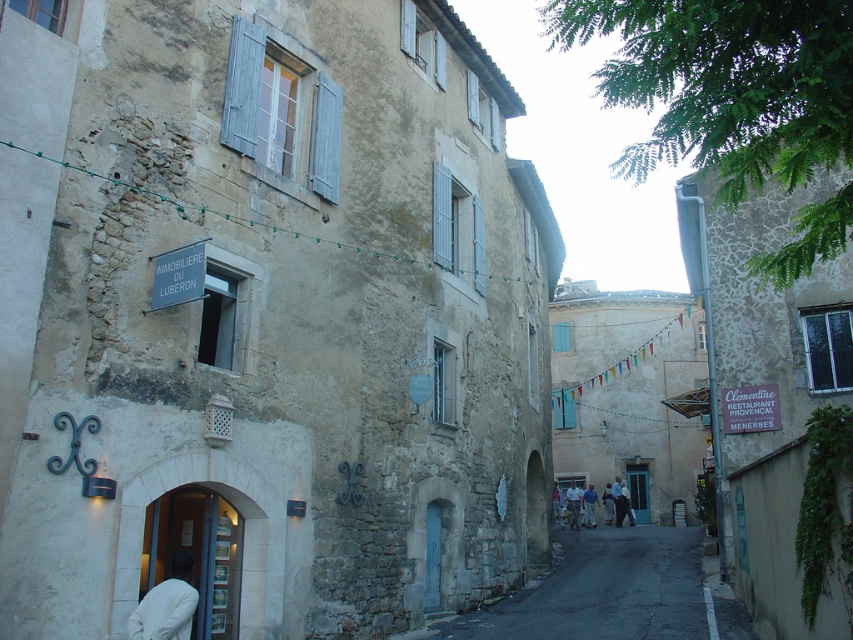
You are a delivery person driving a truck that is 2 meters wide. You need to pass through the street shown in the image. Can your truck fit through the space between the dark asphalt road at center and the white cloth at lower left?

The dark asphalt road at center might be wider than white cloth at lower left, so there is a possibility that the truck can pass through, but there is uncertainty due to the comparative width not being definitively confirmed.

You are a tourist in the village and want to take a photo of the stone signboard at upper center without the dark asphalt road at center blocking it. How should you position yourself relative to the road?

The stone signboard at upper center is behind the dark asphalt road at center. To avoid the road blocking the signboard, you should position yourself behind the dark asphalt road at center so that the road is between you and the signboard, allowing you to capture the signboard without obstruction.

You are a tourist in the village and want to find the IMMOBILIERE DU LUBERON. You see the dark asphalt road at center and the stone signboard at upper center. Which object is located to the right of the other?

The dark asphalt road at center is to the right of the stone signboard at upper center.